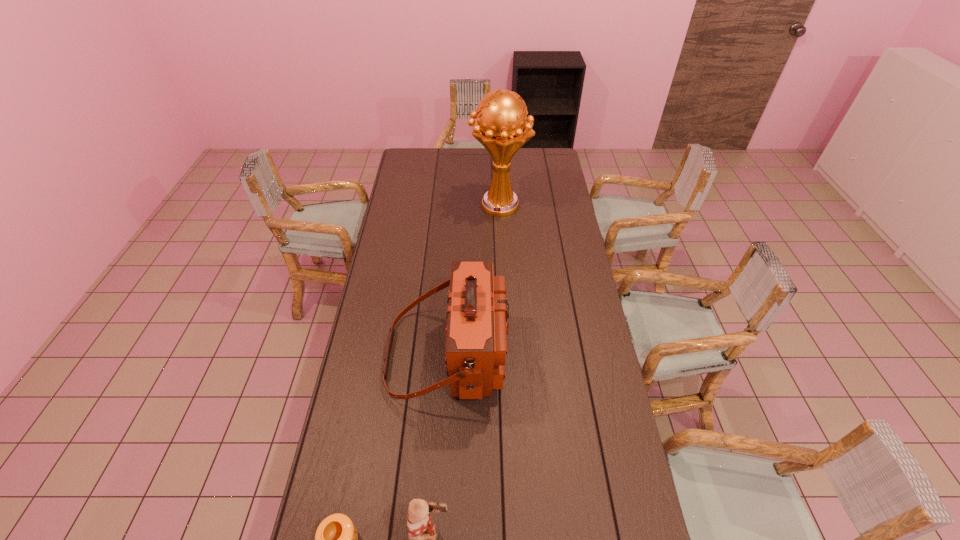
I want to click on the farthest object, so click(502, 127).

Where is `the tallest object`? The width and height of the screenshot is (960, 540). the tallest object is located at coordinates (x=502, y=127).

At what (x,y) coordinates should I click in order to perform the action: click on satchel. Please return your answer as a coordinate pair (x, y). The height and width of the screenshot is (540, 960). Looking at the image, I should click on (476, 334).

Identify the location of the third nearest object. The height and width of the screenshot is (540, 960). (476, 334).

The height and width of the screenshot is (540, 960). What are the coordinates of `vacant space located 0.160m at the front of the farthest object where the globe is prominent` in the screenshot? It's located at (438, 205).

What are the coordinates of `blank space located 0.160m at the front of the farthest object where the globe is prominent` in the screenshot? It's located at (438, 205).

Where is `vacant space situated at the front of the farthest object where the globe is prominent`? Image resolution: width=960 pixels, height=540 pixels. vacant space situated at the front of the farthest object where the globe is prominent is located at coordinates (417, 205).

Locate an element on the screen. This screenshot has height=540, width=960. vacant position located 0.330m on the face side of the third nearest object is located at coordinates (599, 354).

At what (x,y) coordinates should I click in order to perform the action: click on object that is at the left edge. Please return your answer as a coordinate pair (x, y). This screenshot has width=960, height=540. Looking at the image, I should click on click(476, 334).

In the image, there is a desktop. Identify the location of vacant space at the far edge. This screenshot has height=540, width=960. (462, 148).